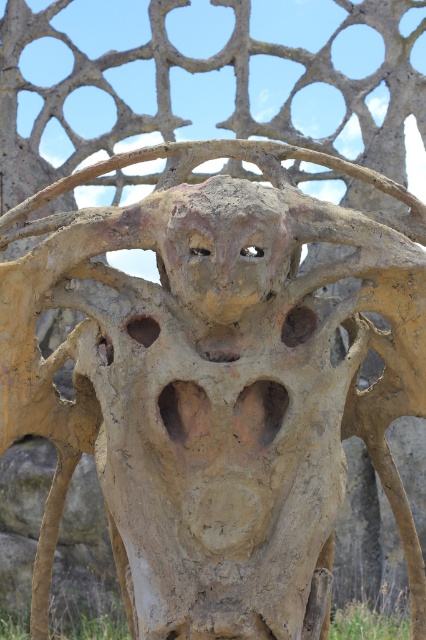
You are an artist looking at the sculpture and the surrounding area. You want to know if the rusty clay face at center can fit entirely within the green grass at lower center. Based on their sizes, can it fit?

The rusty clay face at center is smaller than green grass at lower center, so it can fit entirely within the green grass at lower center.

You are an artist examining the sculpture and the surrounding area. You want to know which object has a greater thickness between the rusty clay face at center and the green grass at lower center. Which one is thicker?

The green grass at lower center is thicker than the rusty clay face at center, as the description states that the rusty clay face at center is thinner than the green grass at lower center.